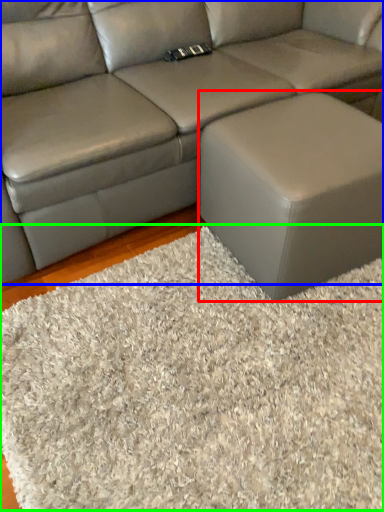
Question: Based on their relative distances, which object is farther from stool (highlighted by a red box)? Choose from studio couch (highlighted by a blue box) and mat (highlighted by a green box).

Choices:
 (A) studio couch
 (B) mat

Answer: (A)